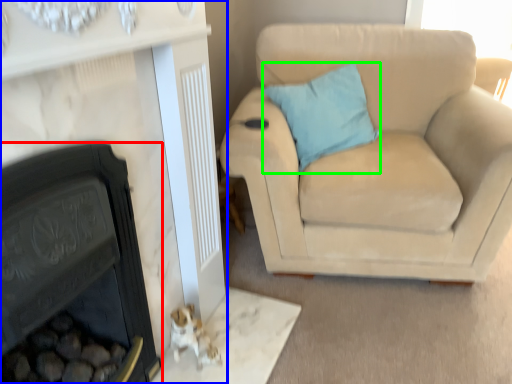
Question: Which is nearer to the fireplace (highlighted by a red box)? fireplace (highlighted by a blue box) or pillow (highlighted by a green box).

Choices:
 (A) fireplace
 (B) pillow

Answer: (A)